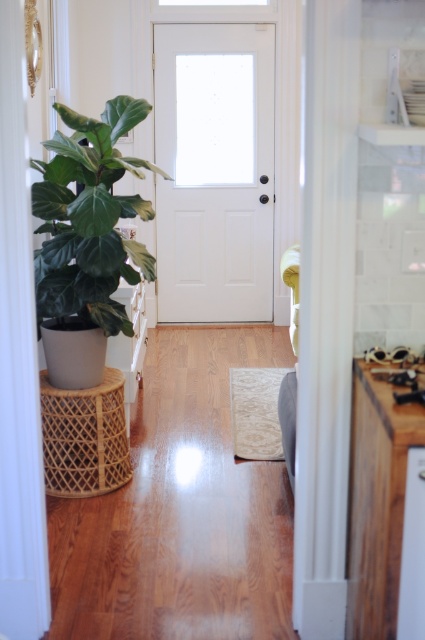
Question: Which point is farther from the camera taking this photo?

Choices:
 (A) (373, 445)
 (B) (175, 188)
 (C) (73, 492)

Answer: (B)

Question: Which of the following is the farthest from the observer?

Choices:
 (A) white matte door at center
 (B) wooden countertop at right

Answer: (A)

Question: Can you confirm if white matte door at center is wider than rattan stool at left?

Choices:
 (A) no
 (B) yes

Answer: (B)

Question: Is green matte plant at left to the left of wooden countertop at right from the viewer's perspective?

Choices:
 (A) no
 (B) yes

Answer: (B)

Question: Estimate the real-world distances between objects in this image. Which object is closer to the white matte door at center?

Choices:
 (A) wooden countertop at right
 (B) rattan stool at left
 (C) green matte plant at left

Answer: (C)

Question: Is white matte door at center smaller than rattan stool at left?

Choices:
 (A) yes
 (B) no

Answer: (B)